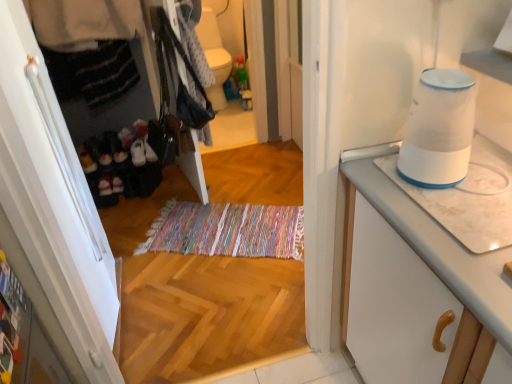
Question: From the image's perspective, is white plastic humidifier at upper right located above or below white matte cabinet at left?

Choices:
 (A) below
 (B) above

Answer: (B)

Question: Considering the positions of point click(x=461, y=150) and point click(x=39, y=279), is point click(x=461, y=150) closer or farther from the camera than point click(x=39, y=279)?

Choices:
 (A) farther
 (B) closer

Answer: (B)

Question: Considering the real-world distances, which object is closest to the white marble countertop at right?

Choices:
 (A) black fabric shoes at left
 (B) white plastic humidifier at upper right
 (C) white glossy toilet bowl at upper center
 (D) white matte cabinet at left

Answer: (B)

Question: Considering the real-world distances, which object is closest to the black fabric shoes at left?

Choices:
 (A) white glossy toilet bowl at upper center
 (B) white plastic humidifier at upper right
 (C) white marble countertop at right
 (D) white matte cabinet at left

Answer: (A)